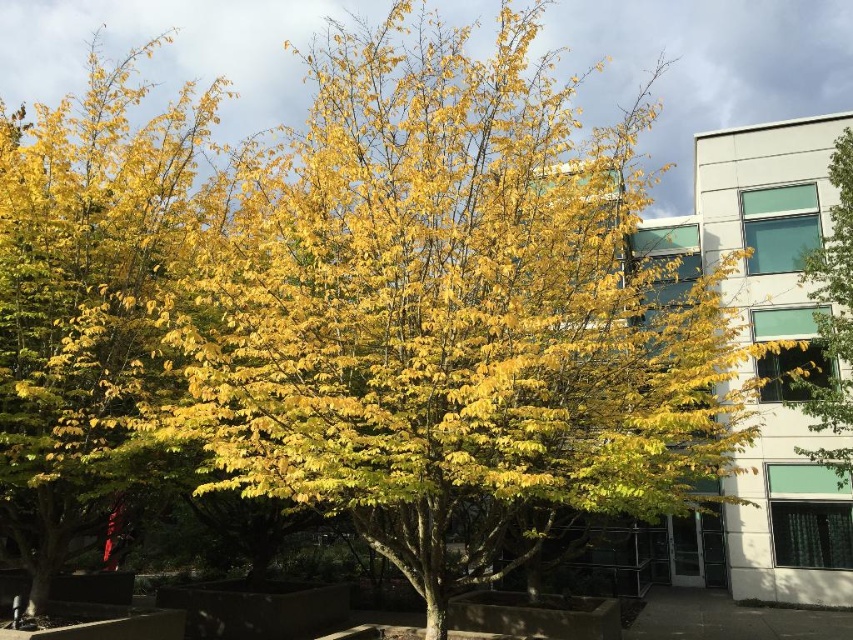
Is point (97, 336) closer to viewer compared to point (807, 276)?

Yes.

Who is positioned more to the right, yellow-green leaves at left or yellow leafy tree at center?

yellow leafy tree at center

Is point (15, 208) farther from viewer compared to point (805, 266)?

No, (15, 208) is closer to viewer.

Locate an element on the screen. yellow-green leaves at left is located at coordinates (84, 298).